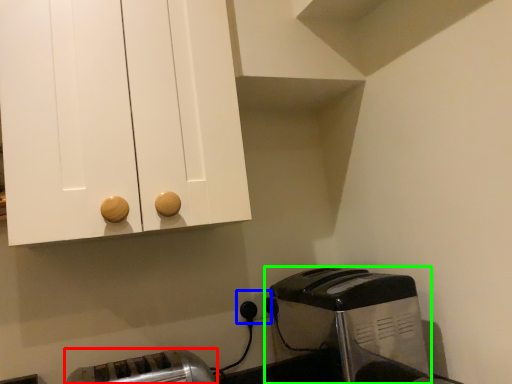
Question: Which object is the closest to the toaster (highlighted by a red box)? Choose among these: electric outlet (highlighted by a blue box) or toaster (highlighted by a green box).

Choices:
 (A) electric outlet
 (B) toaster

Answer: (A)